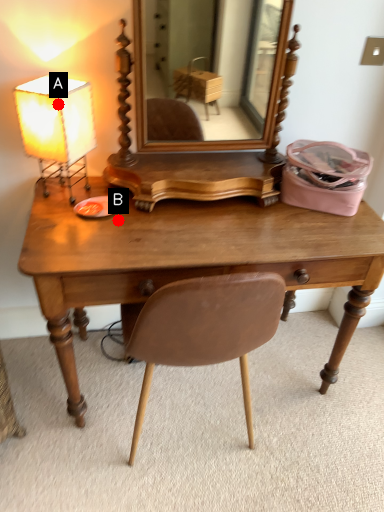
Question: Two points are circled on the image, labeled by A and B beside each circle. Among these points, which one is nearest to the camera?

Choices:
 (A) A is closer
 (B) B is closer

Answer: (A)